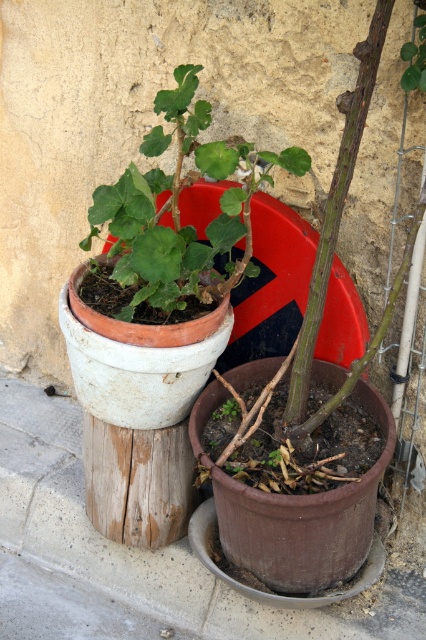
Between green matte pot at center and green matte plant at center, which one appears on the left side from the viewer's perspective?

From the viewer's perspective, green matte pot at center appears more on the left side.

Is point (172, 209) positioned in front of point (233, 406)?

Yes, it is in front of point (233, 406).

Where is `green matte pot at center`? green matte pot at center is located at coordinates (178, 208).

Between green matte pot at center and green matte leaf at center, which one has more height?

Standing taller between the two is green matte pot at center.

You are a GUI agent. You are given a task and a screenshot of the screen. Output one action in this format:
    pyautogui.click(x=<x>, y=<y>)
    Task: Click on the green matte pot at center
    This screenshot has width=426, height=640.
    Given the screenshot: What is the action you would take?
    pyautogui.click(x=178, y=208)

What are the coordinates of `green matte pot at center` in the screenshot? It's located at (178, 208).

Does green matte leaf at center have a smaller size compared to green matte plant at center?

Incorrect, green matte leaf at center is not smaller in size than green matte plant at center.

Image resolution: width=426 pixels, height=640 pixels. What do you see at coordinates (414, 58) in the screenshot?
I see `green matte leaf at center` at bounding box center [414, 58].

Between point (409, 84) and point (230, 397), which one is positioned in front?

Point (409, 84) is in front.

Where is `green matte leaf at center`? green matte leaf at center is located at coordinates point(414,58).